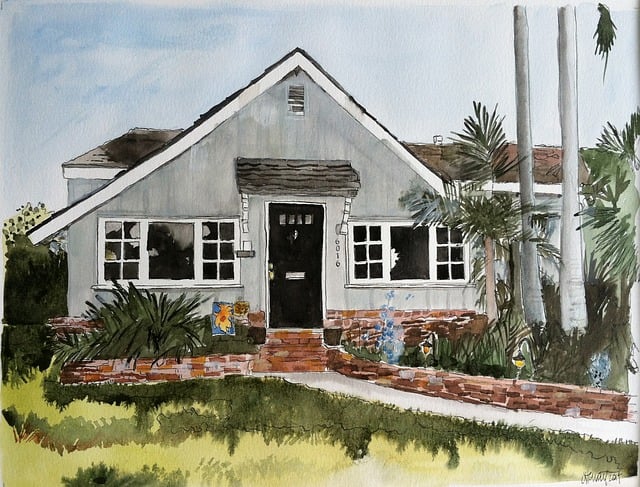
Where is `brick wall`? brick wall is located at coordinates (532, 396), (408, 316), (209, 361).